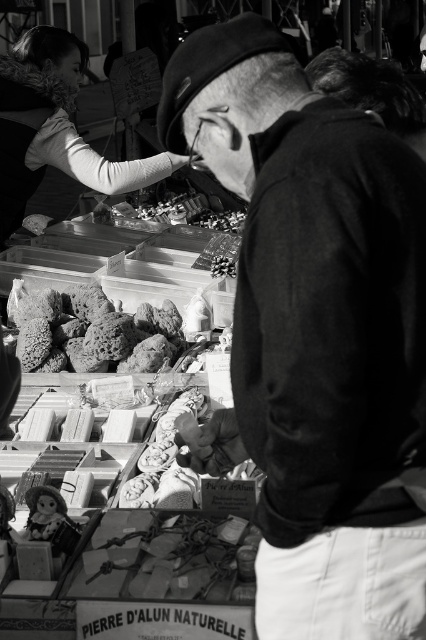
You are a customer at the market stall and want to compare the sizes of the items. Which object is wider between the rough stone at center and the matte plastic doll at lower left?

The rough stone at center is wider than the matte plastic doll at lower left according to the description.

You are standing at the entrance of the market stall and want to reach the rough stone at center. Which direction should you move relative to the items displayed on the stall?

The rough stone at center is located at point (85, 328), so you should move towards the center of the stall to reach it.